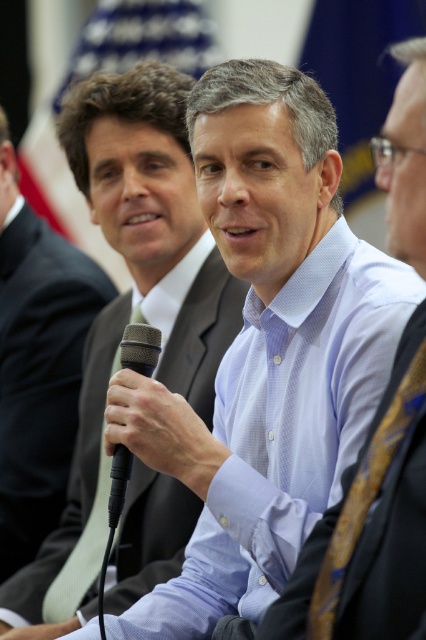
You are organizing a photo shoot and need to ensure that all clothing items in the image are visible. Given that the light blue textured shirt at center and the yellow silk tie at center are both important elements, which clothing item should you focus on adjusting if you need to make one of them larger to ensure visibility?

The light blue textured shirt at center is larger than the yellow silk tie at center, so you should focus on adjusting the yellow silk tie at center to make it larger for better visibility.

You are an event photographer trying to capture a clear shot of the speaker. You notice the yellow silk tie at center and the black matte microphone at center. Which object is closer to the camera based on their positions?

The yellow silk tie at center is positioned under the black matte microphone at center, meaning the microphone is closer to the camera. Therefore, the black matte microphone at center is closer to the camera.